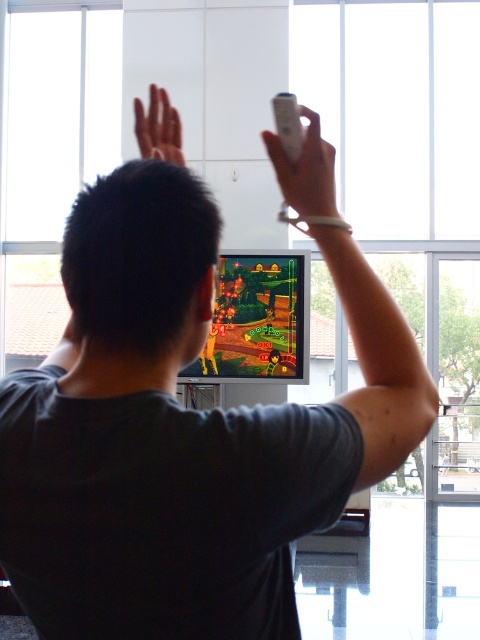
You are a motion sensor in the living room. You detect two points in the scene, point 1 at coordinates point (319, 204) and point 2 at coordinates point (288, 97). Which point is closer to you?

Point 2 at coordinates point (288, 97) is closer to you because it is in front of point 1 at coordinates point (319, 204).

You are a game developer analyzing a player using two remotes. The player is holding the white matte remote control at upper center and the white plastic remote at upper center. Which remote is taller?

The white matte remote control at upper center is taller than the white plastic remote at upper center.

You are a physical therapist observing a patient using motion controls for a video game. The patient has a smooth skin hand at upper center and a white plastic remote at upper center. Which object is bigger in size?

The smooth skin hand at upper center is larger in size than the white plastic remote at upper center.